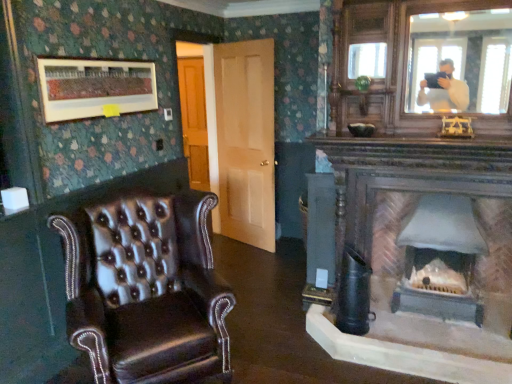
What are the coordinates of `vacant space in front of light brown wood door at center` in the screenshot? It's located at (257, 264).